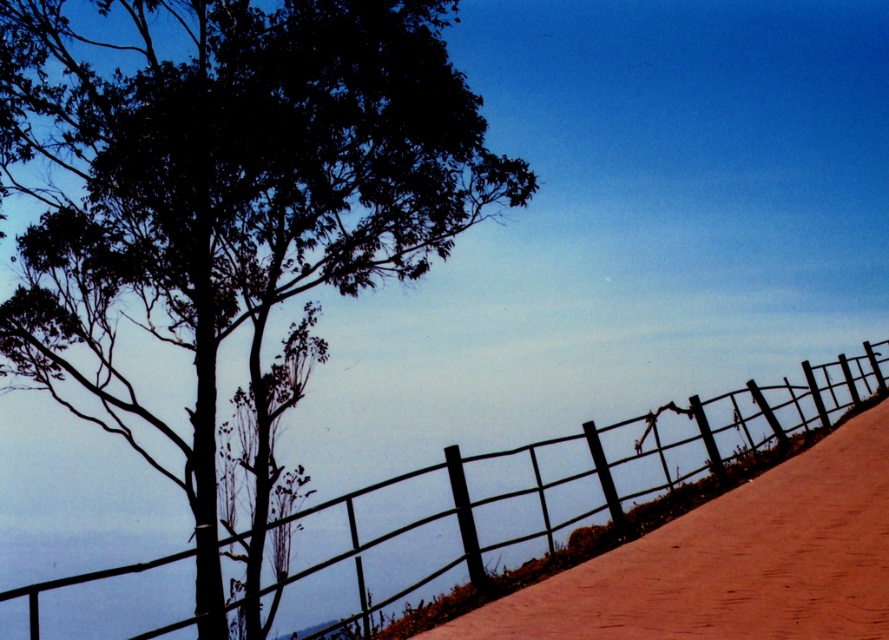
Consider the image. Is brown textured dirt track at center-right in front of metallic wire fence at upper center?

No.

Is brown textured dirt track at center-right taller than metallic wire fence at upper center?

No, brown textured dirt track at center-right is not taller than metallic wire fence at upper center.

Measure the distance between point (763,584) and camera.

They are 9.83 meters apart.

Locate an element on the screen. Image resolution: width=889 pixels, height=640 pixels. brown textured dirt track at center-right is located at coordinates (733, 561).

Does dark green leafy tree at upper left lie behind brown textured dirt track at center-right?

Yes, it is.

Is point (262, 243) closer to viewer compared to point (733, 602)?

No, (262, 243) is behind (733, 602).

This screenshot has height=640, width=889. Describe the element at coordinates (228, 205) in the screenshot. I see `dark green leafy tree at upper left` at that location.

This screenshot has width=889, height=640. Identify the location of dark green leafy tree at upper left. (228, 205).

At what (x,y) coordinates should I click in order to perform the action: click on dark green leafy tree at upper left. Please return your answer as a coordinate pair (x, y). Image resolution: width=889 pixels, height=640 pixels. Looking at the image, I should click on (228, 205).

Who is more forward, (49, 3) or (386, 484)?

Positioned in front is point (386, 484).

I want to click on dark green leafy tree at upper left, so click(x=228, y=205).